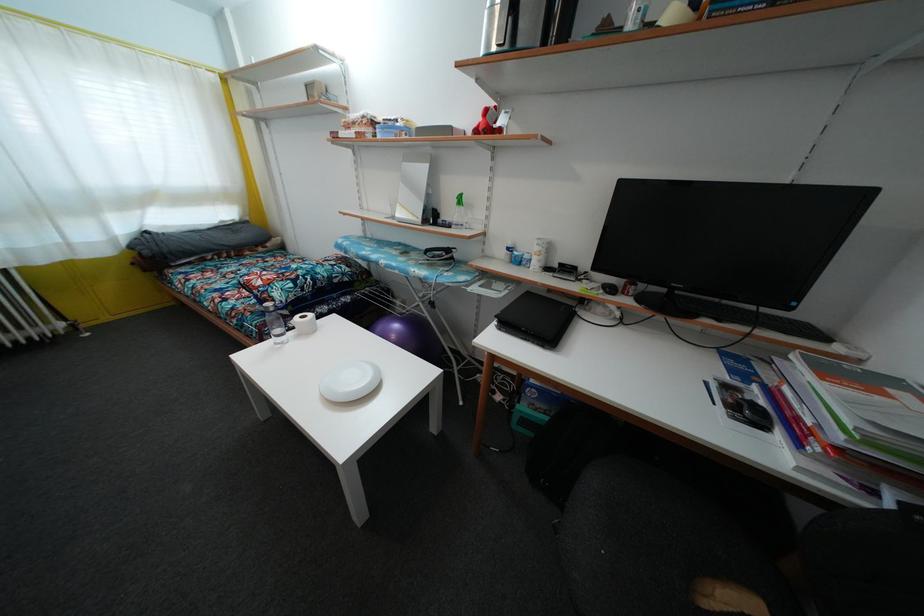
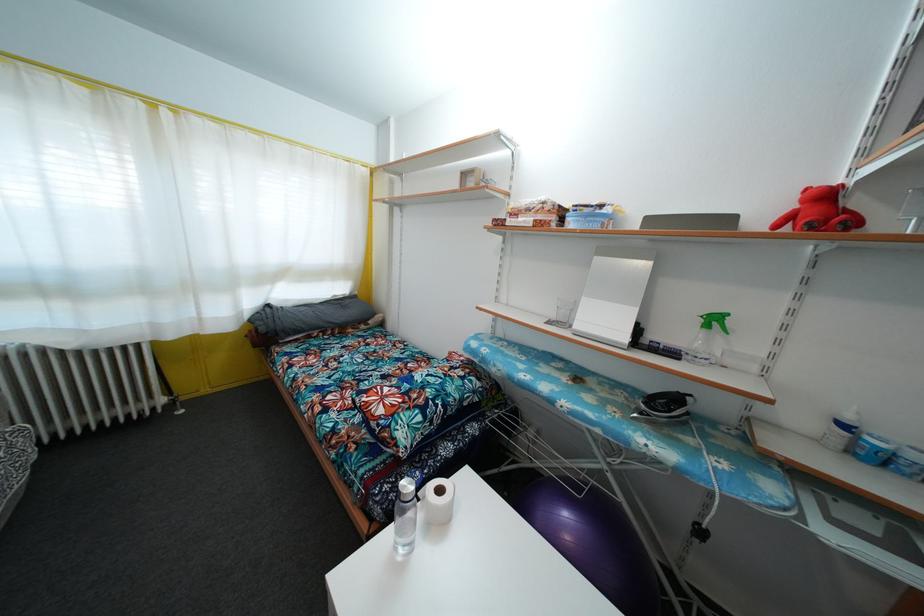
The point at (400, 127) is marked in the first image. Where is the corresponding point in the second image?

(605, 213)